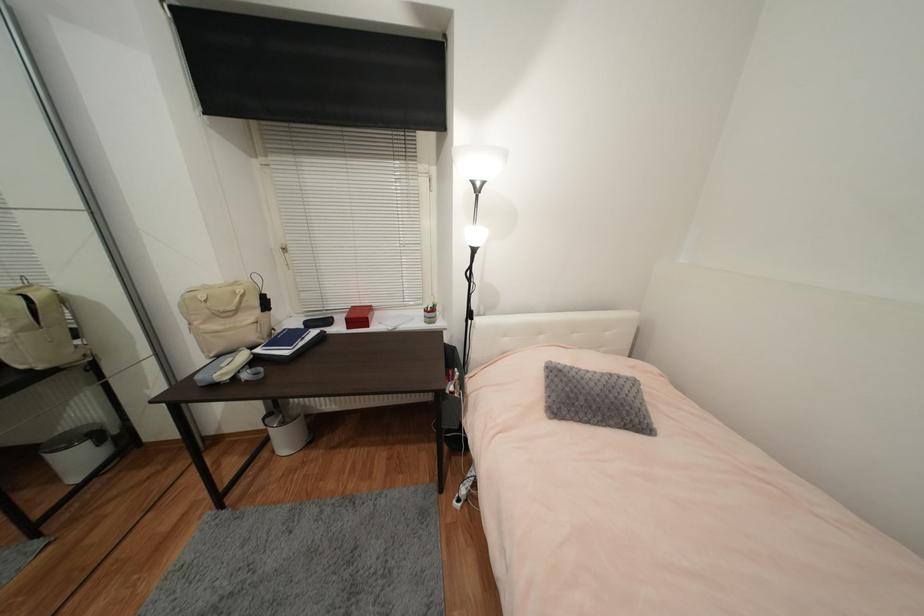
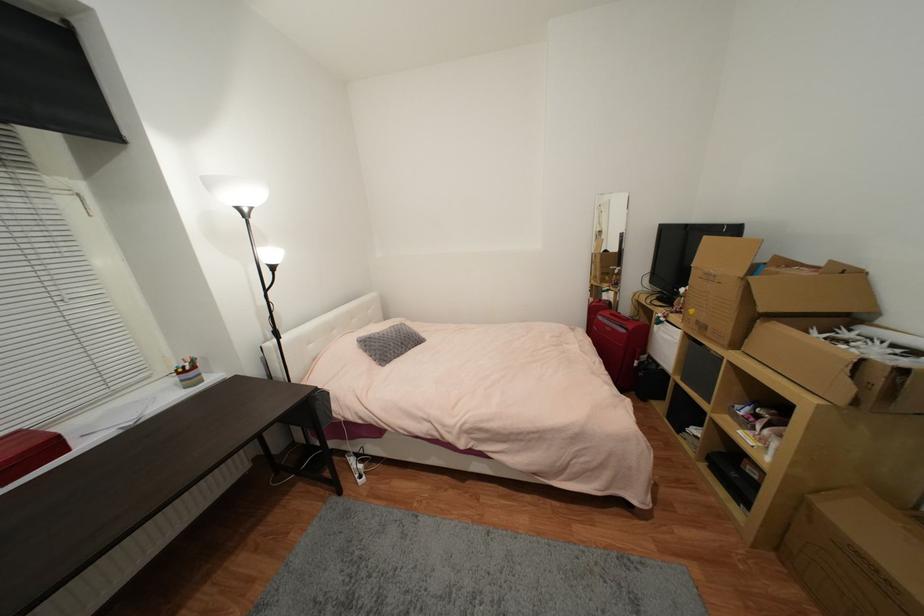
Find the pixel in the second image that matches (558,362) in the first image.

(365, 338)